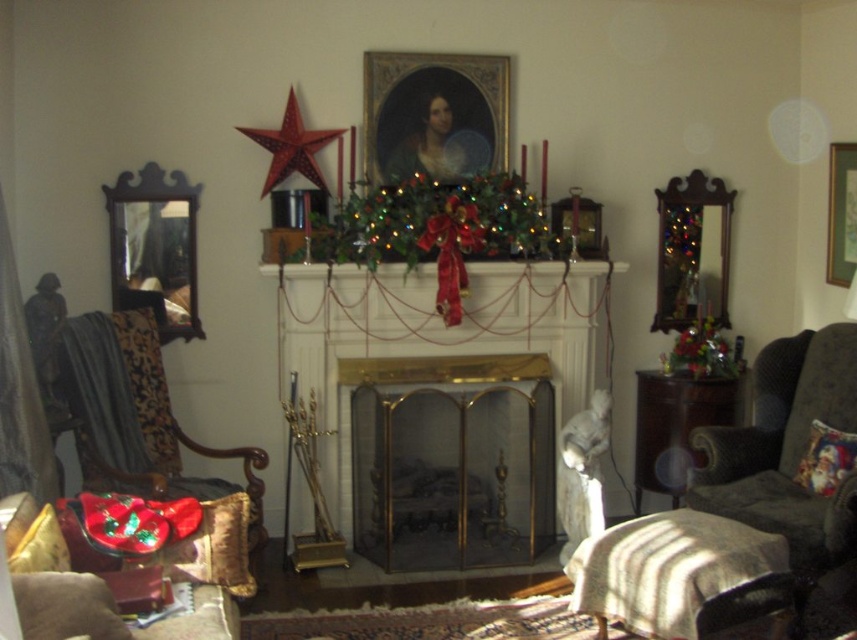
Question: Among these objects, which one is nearest to the camera?

Choices:
 (A) gold metallic fireplace at center
 (B) dark gray fabric at lower right

Answer: (B)

Question: Can you confirm if gold metallic fireplace at center is positioned to the left of velvet cushioned chair at left?

Choices:
 (A) no
 (B) yes

Answer: (A)

Question: Which point is closer to the camera?

Choices:
 (A) (850, 253)
 (B) (124, 310)
 (C) (429, 77)

Answer: (B)

Question: In this image, where is velvet cushioned chair at left located relative to shiny green garland at center?

Choices:
 (A) above
 (B) below

Answer: (B)

Question: Among these points, which one is nearest to the camera?

Choices:
 (A) (133, 381)
 (B) (436, 60)
 (C) (466, 538)

Answer: (A)

Question: Is gold metallic fireplace at center wider than gold-framed portrait at center?

Choices:
 (A) no
 (B) yes

Answer: (B)